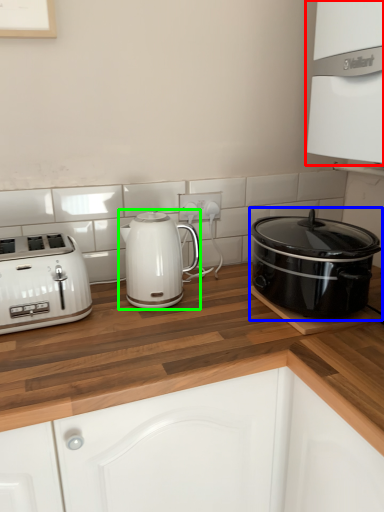
Question: Which is nearer to the oven (highlighted by a red box)? slow cooker (highlighted by a blue box) or kettle (highlighted by a green box).

Choices:
 (A) slow cooker
 (B) kettle

Answer: (A)